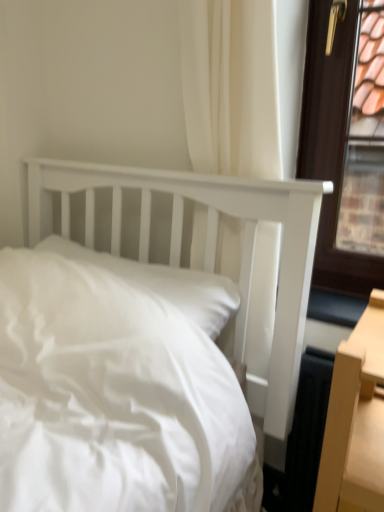
Question: Is the depth of white smooth pillow at center greater than that of white fabric curtain at upper center?

Choices:
 (A) yes
 (B) no

Answer: (A)

Question: Can you confirm if white smooth pillow at center is positioned to the left of white fabric curtain at upper center?

Choices:
 (A) no
 (B) yes

Answer: (B)

Question: Is white smooth pillow at center thinner than white fabric curtain at upper center?

Choices:
 (A) no
 (B) yes

Answer: (A)

Question: Could you tell me if white smooth pillow at center is turned towards white fabric curtain at upper center?

Choices:
 (A) yes
 (B) no

Answer: (B)

Question: From a real-world perspective, is white smooth pillow at center under white fabric curtain at upper center?

Choices:
 (A) yes
 (B) no

Answer: (A)

Question: Is white smooth pillow at center closer to camera compared to white fabric curtain at upper center?

Choices:
 (A) no
 (B) yes

Answer: (A)

Question: Can you confirm if white fabric curtain at upper center is smaller than white smooth pillow at center?

Choices:
 (A) yes
 (B) no

Answer: (B)

Question: From a real-world perspective, is white fabric curtain at upper center on top of white smooth pillow at center?

Choices:
 (A) yes
 (B) no

Answer: (A)

Question: Is there a large distance between white fabric curtain at upper center and white smooth pillow at center?

Choices:
 (A) no
 (B) yes

Answer: (A)

Question: From the image's perspective, is white fabric curtain at upper center on top of white smooth pillow at center?

Choices:
 (A) no
 (B) yes

Answer: (B)

Question: Is white fabric curtain at upper center positioned with its back to white smooth pillow at center?

Choices:
 (A) yes
 (B) no

Answer: (B)

Question: Is white fabric curtain at upper center completely or partially outside of white smooth pillow at center?

Choices:
 (A) no
 (B) yes

Answer: (B)

Question: Considering the positions of point (203, 117) and point (69, 242), is point (203, 117) closer or farther from the camera than point (69, 242)?

Choices:
 (A) farther
 (B) closer

Answer: (B)